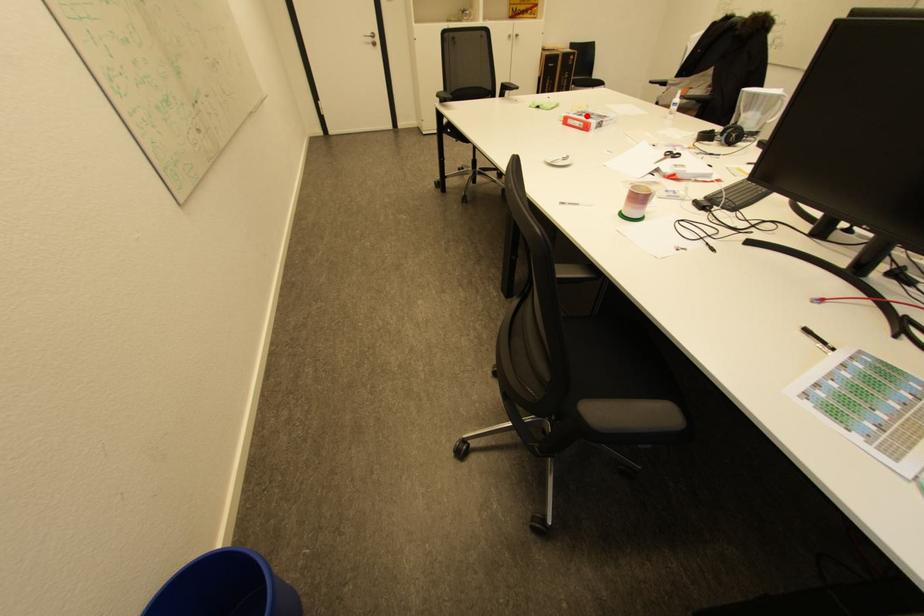
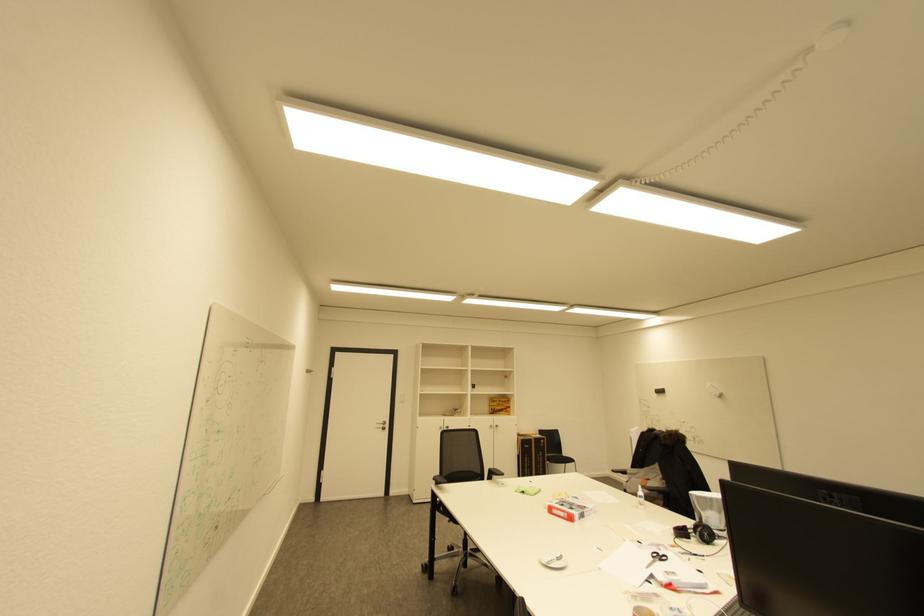
Question: I am providing you with two images of the same scene from different viewpoints. A red point is shown in image1. For the corresponding object point in image2, is it positioned nearer or farther from the camera?

Choices:
 (A) Nearer
 (B) Farther

Answer: (A)